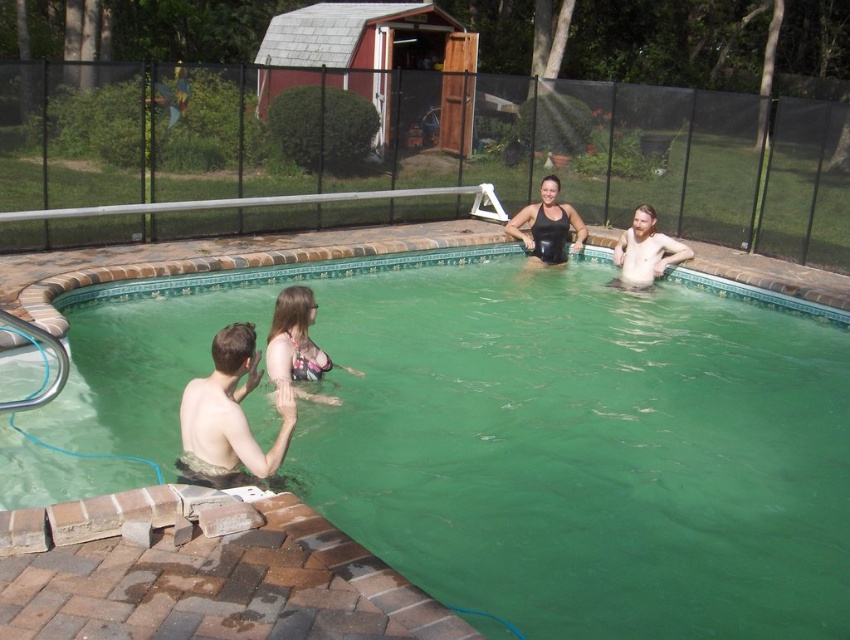
Question: Considering the real-world distances, which object is closest to the patterned bikini top at center?

Choices:
 (A) shiny brown hair at upper right
 (B) black matte swimsuit at upper center
 (C) green smooth water at center
 (D) skinny white man at lower left

Answer: (D)

Question: Which point is farther to the camera?

Choices:
 (A) patterned bikini top at center
 (B) shiny brown hair at upper right
 (C) black matte swimsuit at upper center
 (D) skinny white man at lower left

Answer: (C)

Question: Is patterned bikini top at center thinner than black matte swimsuit at upper center?

Choices:
 (A) yes
 (B) no

Answer: (A)

Question: Can you confirm if green smooth water at center is wider than black matte swimsuit at upper center?

Choices:
 (A) yes
 (B) no

Answer: (B)

Question: Does patterned bikini top at center appear on the left side of black matte swimsuit at upper center?

Choices:
 (A) yes
 (B) no

Answer: (A)

Question: Estimate the real-world distances between objects in this image. Which object is farther from the black matte swimsuit at upper center?

Choices:
 (A) patterned bikini top at center
 (B) shiny brown hair at upper right

Answer: (A)